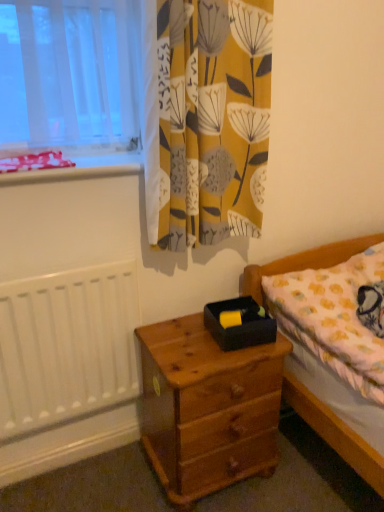
Question: Looking at their shapes, would you say wooden nightstand at lower center is wider or thinner than white painted radiator at left?

Choices:
 (A) wide
 (B) thin

Answer: (A)

Question: From the image's perspective, is wooden nightstand at lower center above or below white painted radiator at left?

Choices:
 (A) above
 (B) below

Answer: (B)

Question: Which object is positioned farthest from the wooden bed at lower right?

Choices:
 (A) wooden nightstand at lower center
 (B) black matte box at center
 (C) red plastic tray at upper left
 (D) yellow fabric curtain at upper center
 (E) white painted radiator at left

Answer: (C)

Question: Estimate the real-world distances between objects in this image. Which object is farther from the wooden bed at lower right?

Choices:
 (A) red plastic tray at upper left
 (B) wooden nightstand at lower center
 (C) black matte box at center
 (D) white painted radiator at left
 (E) yellow fabric curtain at upper center

Answer: (A)